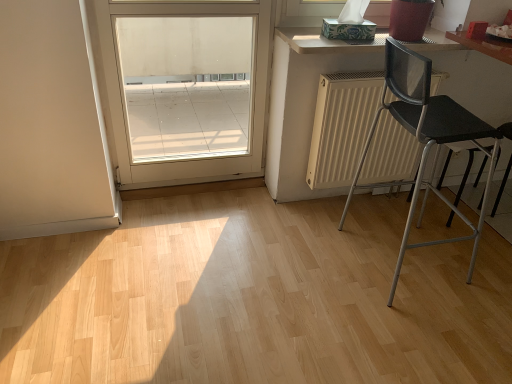
The image size is (512, 384). What are the coordinates of `vacant space in white matte radiator at center (from a real-world perspective)` in the screenshot? It's located at (333, 205).